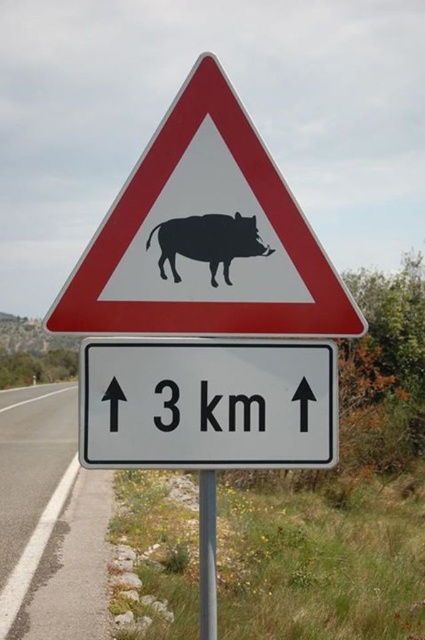
Can you confirm if black plastic boar at center is positioned to the right of white asphalt road at lower left?

Indeed, black plastic boar at center is positioned on the right side of white asphalt road at lower left.

The height and width of the screenshot is (640, 425). I want to click on black plastic boar at center, so click(215, 252).

The image size is (425, 640). Find the location of `black plastic boar at center`. black plastic boar at center is located at coordinates (215, 252).

Is the position of white plastic sign at center less distant than that of metallic pole at center?

Yes, white plastic sign at center is closer to the viewer.

Find the location of `white plastic sign at center`. white plastic sign at center is located at coordinates (206, 403).

Does point (124, 380) come in front of point (200, 481)?

That is True.

Locate an element on the screen. white plastic sign at center is located at coordinates (206, 403).

Consider the image. Does black plastic boar at center appear on the right side of white plastic sign at center?

In fact, black plastic boar at center is to the left of white plastic sign at center.

Between black plastic boar at center and white plastic sign at center, which one has less height?

white plastic sign at center

This screenshot has height=640, width=425. In order to click on black plastic boar at center in this screenshot , I will do `click(215, 252)`.

I want to click on black plastic boar at center, so click(215, 252).